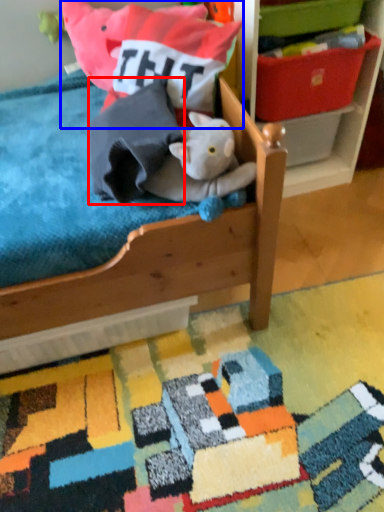
Question: Which of the following is the closest to the observer, throw pillow (highlighted by a red box) or pillow (highlighted by a blue box)?

Choices:
 (A) throw pillow
 (B) pillow

Answer: (A)